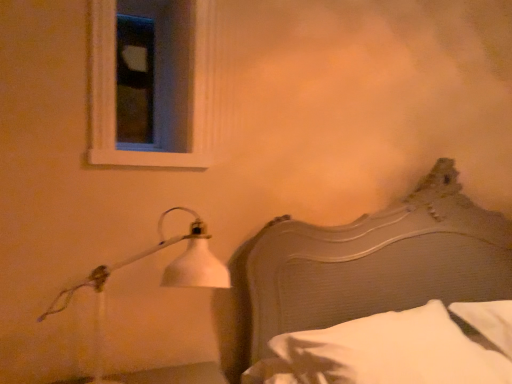
Question: Considering the positions of white matte lamp at left and white soft pillow at lower right in the image, is white matte lamp at left taller or shorter than white soft pillow at lower right?

Choices:
 (A) tall
 (B) short

Answer: (A)

Question: Relative to white soft pillow at lower right, is white matte lamp at left in front or behind?

Choices:
 (A) front
 (B) behind

Answer: (B)

Question: Based on their relative distances, which object is nearer to the wooden headboard at right?

Choices:
 (A) white wood frame at upper left
 (B) white matte lamp at left
 (C) white soft pillow at lower right

Answer: (C)

Question: Estimate the real-world distances between objects in this image. Which object is closer to the white wood frame at upper left?

Choices:
 (A) wooden headboard at right
 (B) white matte lamp at left
 (C) white soft pillow at lower right

Answer: (B)